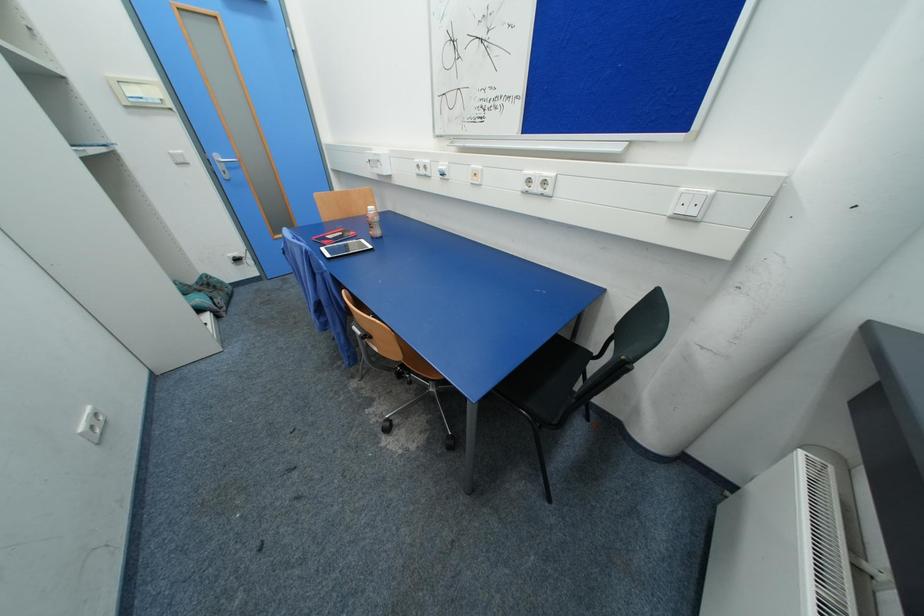
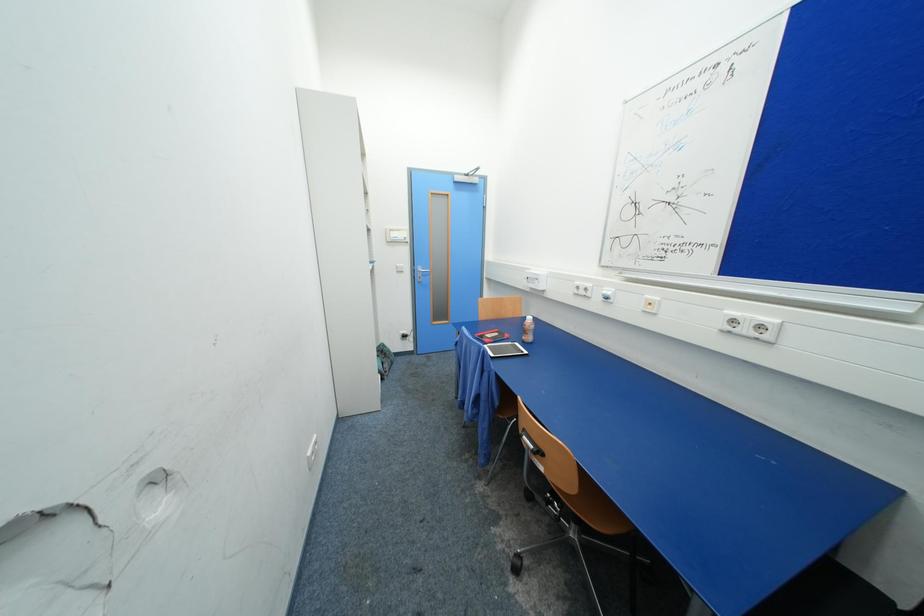
Based on the photo, how did the camera likely rotate?

The camera rotated toward left-up.